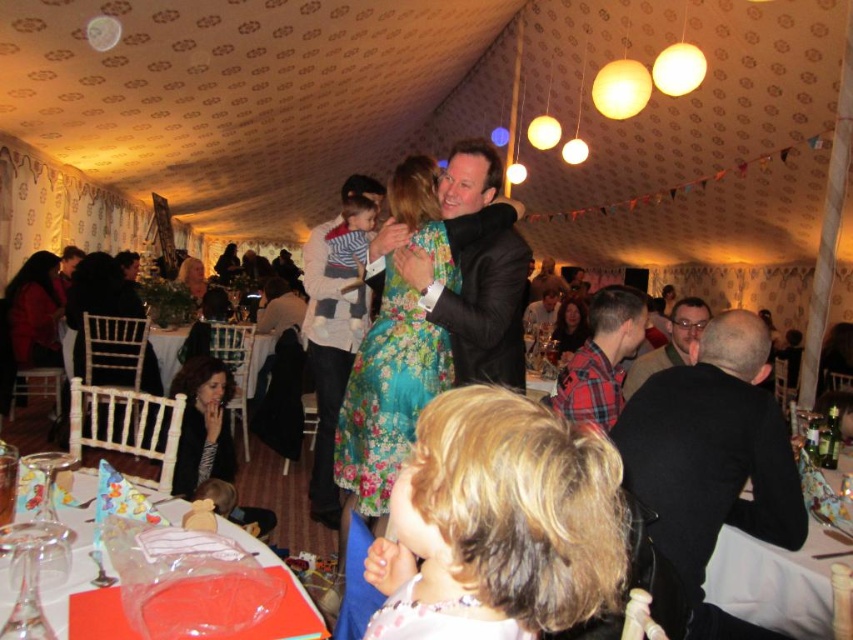
Does white fabric table at lower right have a lesser width compared to matte black jacket at lower right?

No.

Is white fabric table at lower right shorter than matte black jacket at lower right?

Correct, white fabric table at lower right is not as tall as matte black jacket at lower right.

Locate an element on the screen. Image resolution: width=853 pixels, height=640 pixels. white fabric table at lower right is located at coordinates (776, 579).

This screenshot has height=640, width=853. Find the location of `white fabric table at lower right`. white fabric table at lower right is located at coordinates (776, 579).

Consider the image. Which of these two, black matte shirt at right or matte black jacket at left, stands taller?

matte black jacket at left is taller.

Does black matte shirt at right appear on the left side of matte black jacket at left?

Incorrect, black matte shirt at right is not on the left side of matte black jacket at left.

Identify the location of black matte shirt at right. (711, 451).

Locate an element on the screen. black matte shirt at right is located at coordinates (711, 451).

Is point (225, 513) positioned behind point (65, 257)?

No, (225, 513) is closer to viewer.

This screenshot has width=853, height=640. In order to click on black textured jacket at lower left in this screenshot , I will do `click(210, 444)`.